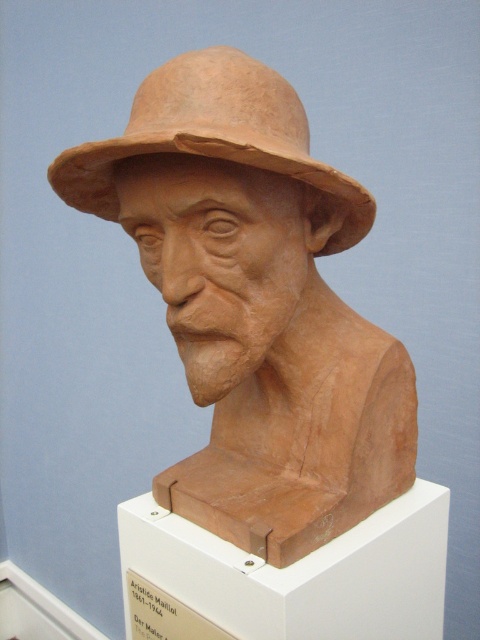
Who is taller, matte clay bust at center or matte clay cowboy hat at center?

matte clay bust at center is taller.

Locate an element on the screen. Image resolution: width=480 pixels, height=640 pixels. matte clay bust at center is located at coordinates (254, 304).